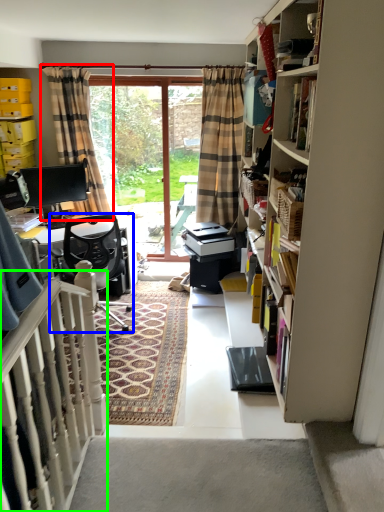
Question: Which object is positioned farthest from curtain (highlighted by a red box)? Select from chair (highlighted by a blue box) and balustrade (highlighted by a green box).

Choices:
 (A) chair
 (B) balustrade

Answer: (B)